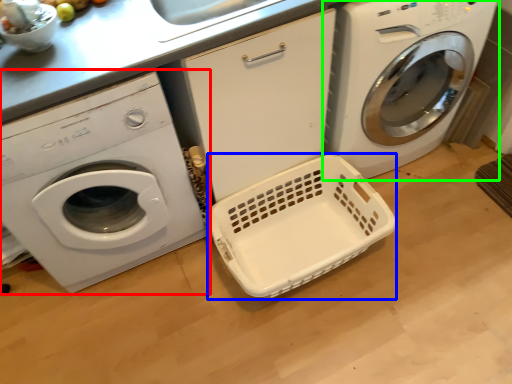
Question: Which is farther away from washing machine (highlighted by a red box)? basket container (highlighted by a blue box) or washing machine (highlighted by a green box)?

Choices:
 (A) basket container
 (B) washing machine

Answer: (B)